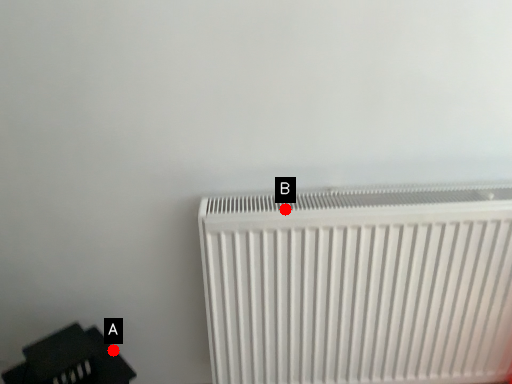
Question: Two points are circled on the image, labeled by A and B beside each circle. Which point is further to the camera?

Choices:
 (A) A is further
 (B) B is further

Answer: (A)